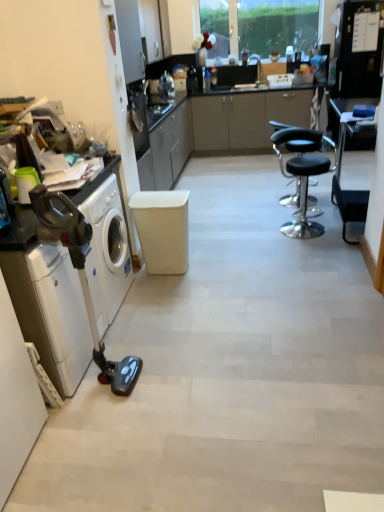
Question: Considering the relative positions of white glossy washing machine at left, marked as the second washing machine in a front-to-back arrangement, and white matte stool at center in the image provided, is white glossy washing machine at left, marked as the second washing machine in a front-to-back arrangement, to the right of white matte stool at center from the viewer's perspective?

Choices:
 (A) no
 (B) yes

Answer: (A)

Question: Would you say white glossy washing machine at left, which is counted as the first washing machine, starting from the back, contains white matte stool at center?

Choices:
 (A) no
 (B) yes

Answer: (A)

Question: Can you confirm if white glossy washing machine at left, marked as the second washing machine in a front-to-back arrangement, is smaller than white matte stool at center?

Choices:
 (A) yes
 (B) no

Answer: (B)

Question: Can you see white glossy washing machine at left, which is counted as the first washing machine, starting from the back, touching white matte stool at center?

Choices:
 (A) no
 (B) yes

Answer: (A)

Question: Is white glossy washing machine at left, which is counted as the first washing machine, starting from the back, wider than white matte stool at center?

Choices:
 (A) no
 (B) yes

Answer: (A)

Question: Is metallic gray vacuum cleaner at left situated inside black plastic table at right or outside?

Choices:
 (A) inside
 (B) outside

Answer: (B)

Question: From a real-world perspective, is metallic gray vacuum cleaner at left physically located above or below black plastic table at right?

Choices:
 (A) above
 (B) below

Answer: (B)

Question: Considering their positions, is metallic gray vacuum cleaner at left located in front of or behind black plastic table at right?

Choices:
 (A) behind
 (B) front

Answer: (B)

Question: Does point (117, 203) appear closer or farther from the camera than point (352, 100)?

Choices:
 (A) closer
 (B) farther

Answer: (A)

Question: Looking at the image, does metallic gray vacuum cleaner at left seem bigger or smaller compared to black leather stool at center?

Choices:
 (A) big
 (B) small

Answer: (A)

Question: In terms of height, does metallic gray vacuum cleaner at left look taller or shorter compared to black leather stool at center?

Choices:
 (A) short
 (B) tall

Answer: (B)

Question: Considering the positions of point (77, 289) and point (302, 184), is point (77, 289) closer or farther from the camera than point (302, 184)?

Choices:
 (A) farther
 (B) closer

Answer: (B)

Question: In the image, is metallic gray vacuum cleaner at left positioned in front of or behind black leather stool at center?

Choices:
 (A) front
 (B) behind

Answer: (A)

Question: From the image's perspective, is white glossy washing machine at left, which is counted as the first washing machine, starting from the back, above or below black leather stool at center?

Choices:
 (A) above
 (B) below

Answer: (B)

Question: Does point (109, 209) appear closer or farther from the camera than point (309, 135)?

Choices:
 (A) farther
 (B) closer

Answer: (B)